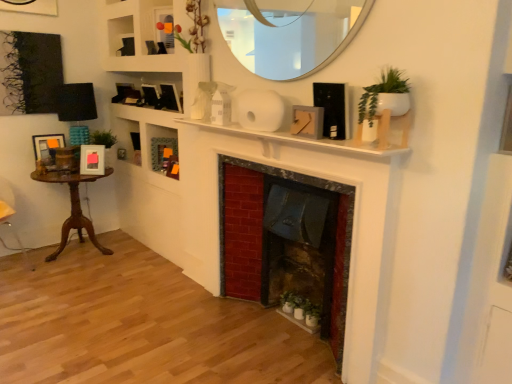
Question: Is green matte cabinet at center closer to the viewer compared to white matte fireplace at center?

Choices:
 (A) yes
 (B) no

Answer: (B)

Question: From the image's perspective, is green matte cabinet at center above white matte fireplace at center?

Choices:
 (A) no
 (B) yes

Answer: (B)

Question: Is green matte cabinet at center facing towards white matte fireplace at center?

Choices:
 (A) yes
 (B) no

Answer: (B)

Question: Could white matte fireplace at center be considered to be inside green matte cabinet at center?

Choices:
 (A) no
 (B) yes

Answer: (A)

Question: Is green matte cabinet at center located outside white matte fireplace at center?

Choices:
 (A) yes
 (B) no

Answer: (A)

Question: In the image, is green matte plant at lower center on the left side or the right side of matte black picture frame at upper center, which is counted as the 4th picture frame, starting from the back?

Choices:
 (A) right
 (B) left

Answer: (A)

Question: From the image's perspective, relative to matte black picture frame at upper center, which is the second picture frame from right to left, is green matte plant at lower center above or below?

Choices:
 (A) below
 (B) above

Answer: (A)

Question: In the image, is green matte plant at lower center positioned in front of or behind matte black picture frame at upper center, acting as the 2th picture frame starting from the front?

Choices:
 (A) behind
 (B) front

Answer: (B)

Question: Is green matte plant at lower center bigger or smaller than matte black picture frame at upper center, acting as the 2th picture frame starting from the front?

Choices:
 (A) small
 (B) big

Answer: (A)

Question: Is red brick fireplace at center to the left or to the right of wooden table at left in the image?

Choices:
 (A) left
 (B) right

Answer: (B)

Question: Relative to wooden table at left, is red brick fireplace at center in front or behind?

Choices:
 (A) behind
 (B) front

Answer: (B)

Question: Is red brick fireplace at center situated inside wooden table at left or outside?

Choices:
 (A) inside
 (B) outside

Answer: (B)

Question: From a real-world perspective, is red brick fireplace at center physically located above or below wooden table at left?

Choices:
 (A) below
 (B) above

Answer: (B)

Question: Is green matte cabinet at center to the left or to the right of white glossy mirror at upper center in the image?

Choices:
 (A) left
 (B) right

Answer: (A)

Question: Relative to white glossy mirror at upper center, is green matte cabinet at center in front or behind?

Choices:
 (A) behind
 (B) front

Answer: (A)